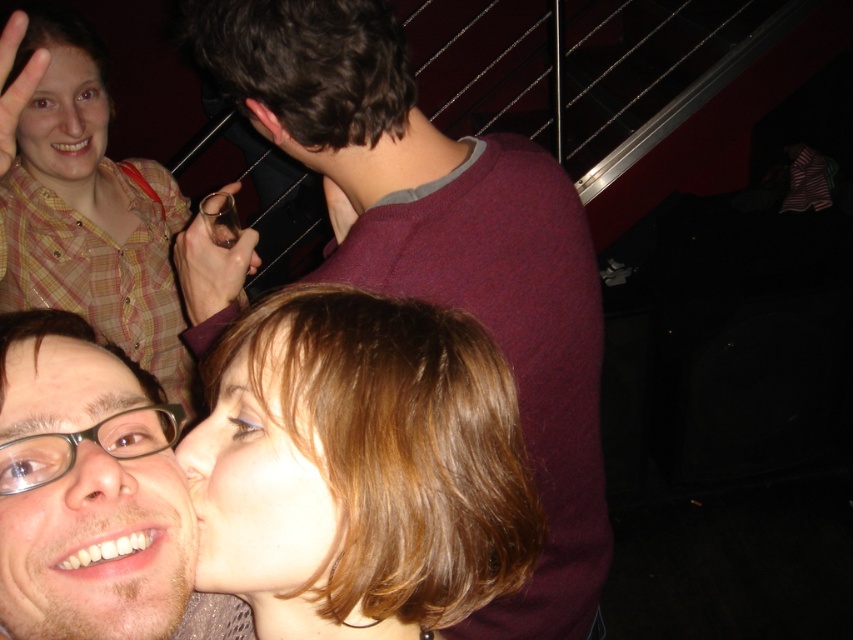
Question: Can you confirm if shiny brown hair at center is positioned to the right of matte yellow shirt at upper left?

Choices:
 (A) no
 (B) yes

Answer: (B)

Question: Which object is the farthest from the glossy plastic face at lower left?

Choices:
 (A) matte yellow shirt at upper left
 (B) shiny brown hair at center
 (C) plaid shirt at upper left
 (D) smooth skin face at lower center

Answer: (A)

Question: Which object is the closest to the maroon sweater at center?

Choices:
 (A) matte yellow shirt at upper left
 (B) glossy plastic face at lower left

Answer: (B)

Question: Which point is farther to the camera?

Choices:
 (A) (468, 385)
 (B) (281, 342)

Answer: (A)

Question: Is plaid shirt at upper left positioned before matte yellow shirt at upper left?

Choices:
 (A) yes
 (B) no

Answer: (A)

Question: Does smooth skin face at lower center have a larger size compared to matte yellow shirt at upper left?

Choices:
 (A) yes
 (B) no

Answer: (B)